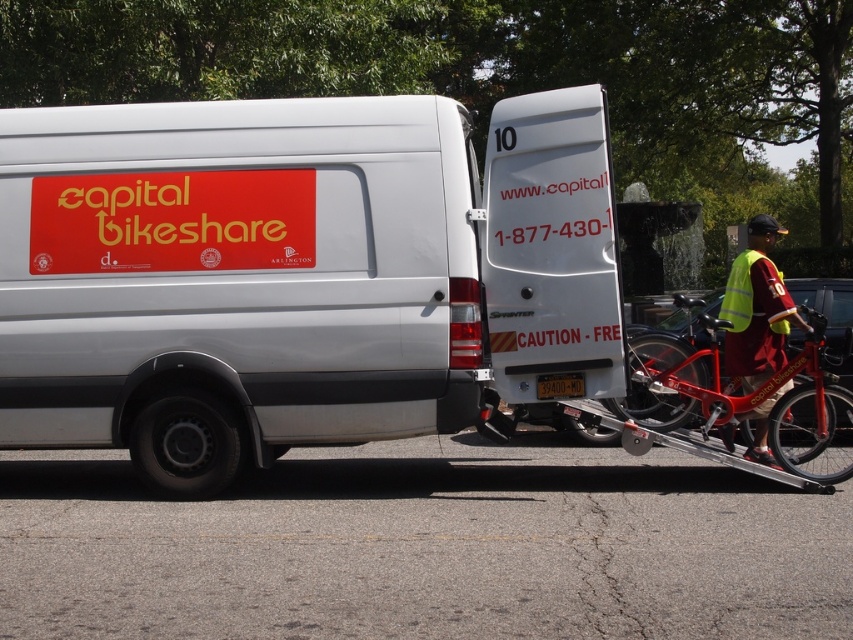
You are a delivery person who needs to park your car next to the white matte van at center and the reflective yellow vest at right. Based on the scene, which object should you park closer to if you want to be closer to the bike station entrance?

The reflective yellow vest at right is positioned to the right of the white matte van at center, so parking closer to the reflective yellow vest at right would place you nearer to the bike station entrance.

You are a delivery person who needs to load a package onto the trailer attached to the van. The package is 30 inches long. Can you fit the package between the metallic red bicycle at right and the reflective yellow vest at right on the trailer?

The distance between the metallic red bicycle at right and the reflective yellow vest at right is 29.75 inches. Since the package is 30 inches long, it is slightly too long to fit in the space between them.

You are a delivery person who needs to load a package into the back of the white matte van at center. The package is too large to fit through the side door. Can you lift it over the metallic red bicycle at right to place it inside the van?

The white matte van at center is much taller than the metallic red bicycle at right, so yes, you can lift the package over the metallic red bicycle at right and place it inside the van.